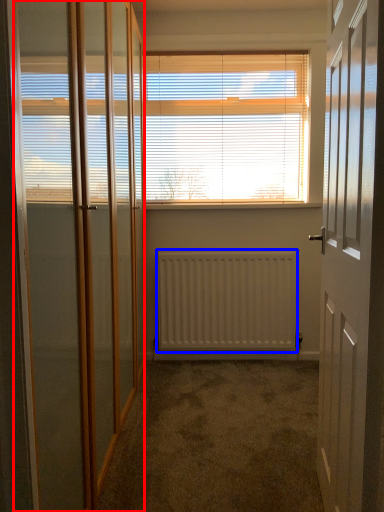
Question: Which point is further to the camera, screen door (highlighted by a red box) or radiator (highlighted by a blue box)?

Choices:
 (A) screen door
 (B) radiator

Answer: (B)